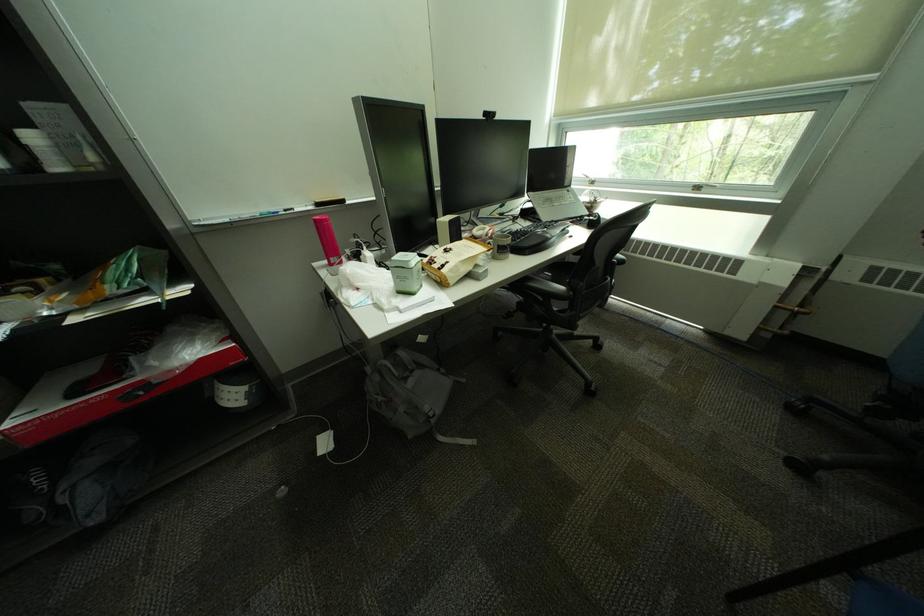
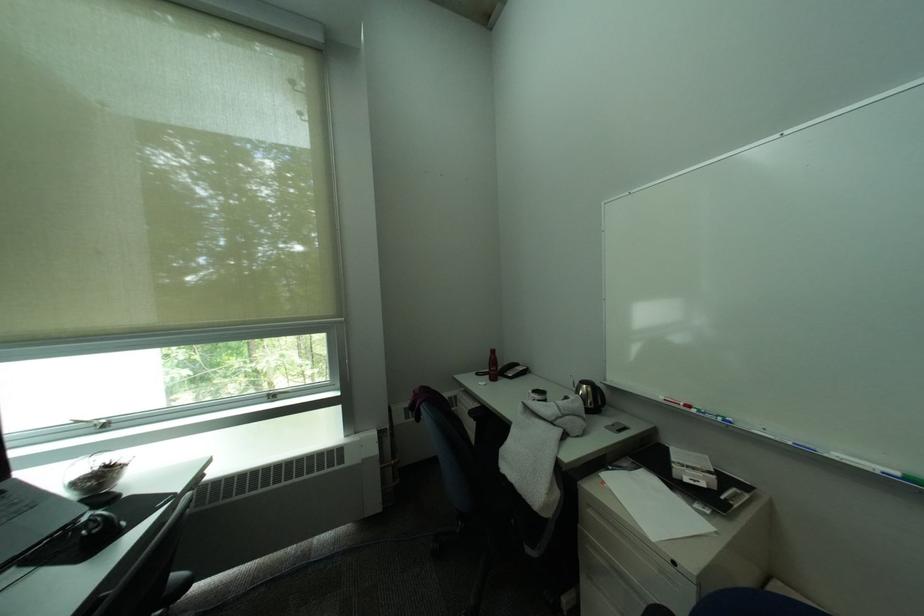
In the second image, find the point that corresponds to (601,182) in the first image.

(106, 427)